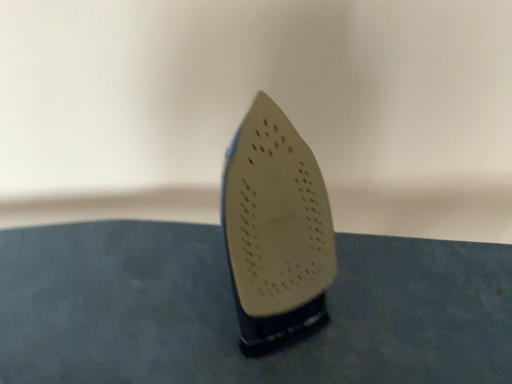
What is the approximate width of matte white iron at center?

6.34 inches.

This screenshot has height=384, width=512. Describe the element at coordinates (275, 231) in the screenshot. I see `matte white iron at center` at that location.

The width and height of the screenshot is (512, 384). Find the location of `matte white iron at center`. matte white iron at center is located at coordinates (275, 231).

You are a GUI agent. You are given a task and a screenshot of the screen. Output one action in this format:
    pyautogui.click(x=<x>, y=<y>)
    Task: Click on the matte white iron at center
    
    Given the screenshot: What is the action you would take?
    pyautogui.click(x=275, y=231)